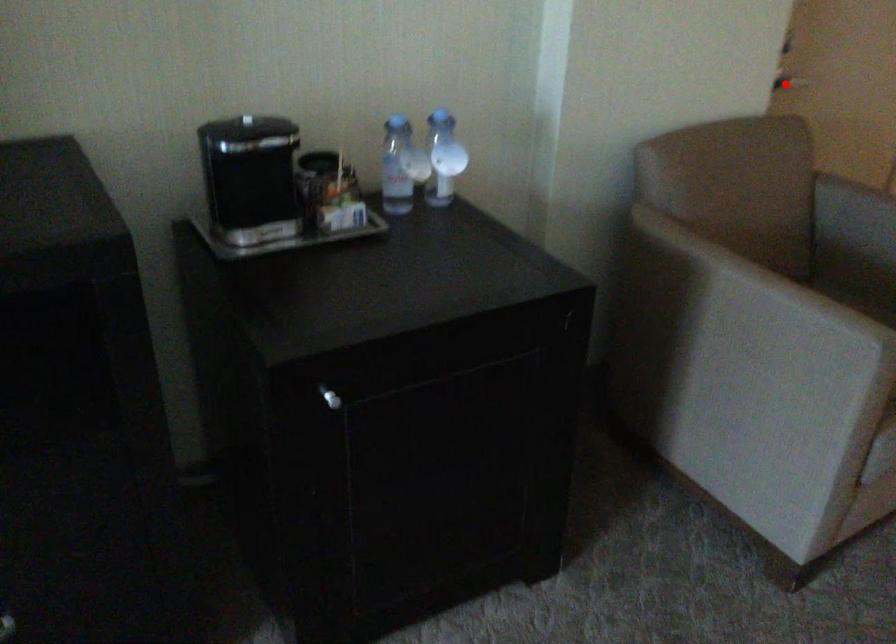
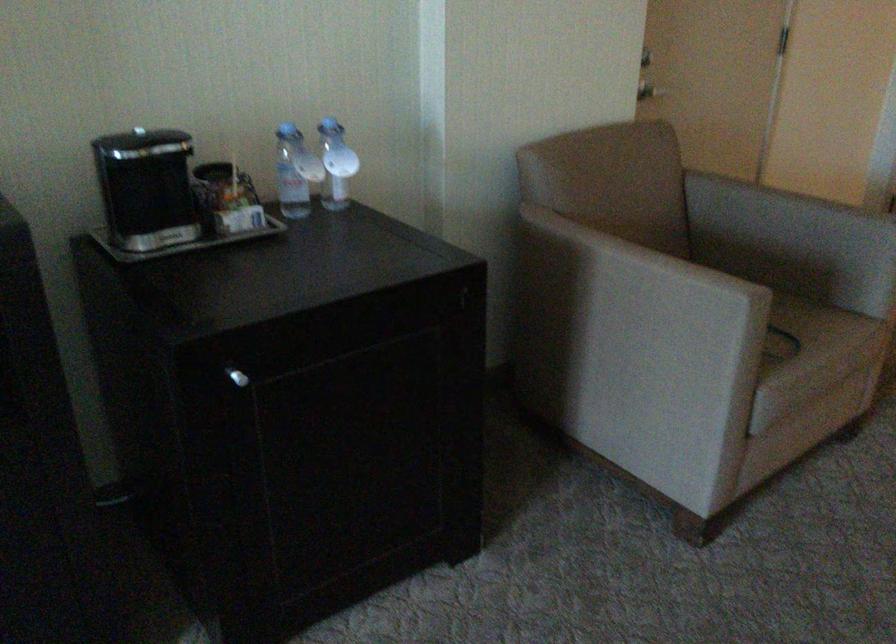
Question: I am providing you with two images of the same scene from different viewpoints. A red point is shown in image1. For the corresponding object point in image2, is it positioned nearer or farther from the camera?

Choices:
 (A) Nearer
 (B) Farther

Answer: (B)